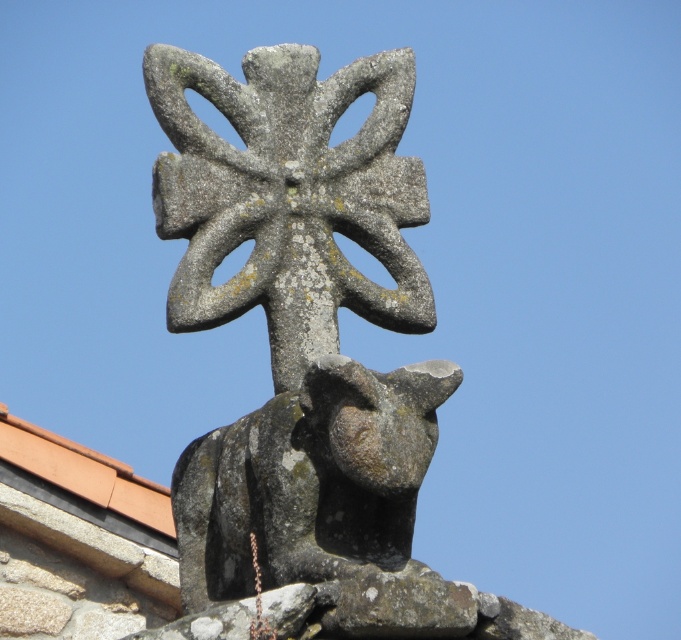
Who is positioned more to the left, gray stone cross at center or terracotta tile roof at upper center?

From the viewer's perspective, terracotta tile roof at upper center appears more on the left side.

Is point (411, 177) closer to viewer compared to point (46, 467)?

Yes, it is in front of point (46, 467).

Identify the location of gray stone cross at center. (298, 316).